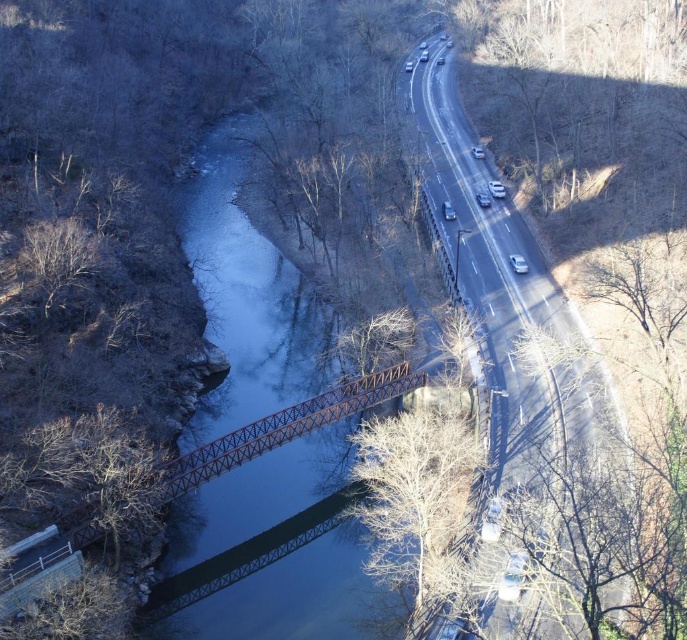
Can you confirm if metallic blue river at center is bigger than rusty metal bridge at center?

Yes, metallic blue river at center is bigger than rusty metal bridge at center.

Is point (260, 596) closer to viewer compared to point (202, 474)?

Yes, point (260, 596) is closer to viewer.

This screenshot has width=687, height=640. In order to click on metallic blue river at center in this screenshot , I will do `click(247, 294)`.